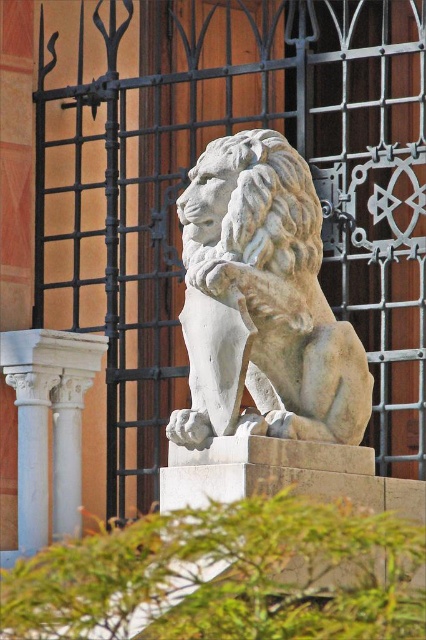
Question: Among these points, which one is farthest from the camera?

Choices:
 (A) (271, 131)
 (B) (46, 369)

Answer: (B)

Question: Is white stone lion at center smaller than white marble column at lower left?

Choices:
 (A) no
 (B) yes

Answer: (A)

Question: Is white stone lion at center bigger than white marble column at lower left?

Choices:
 (A) no
 (B) yes

Answer: (B)

Question: Does white stone lion at center appear on the right side of white marble column at lower left?

Choices:
 (A) yes
 (B) no

Answer: (A)